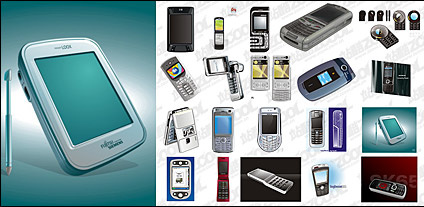
Where is `yellow screen`? yellow screen is located at coordinates (282, 70), (261, 68), (219, 28).